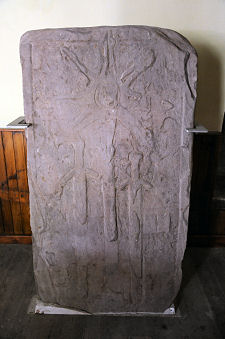
The height and width of the screenshot is (339, 225). I want to click on wooden baseboard, so click(17, 238), click(207, 240).